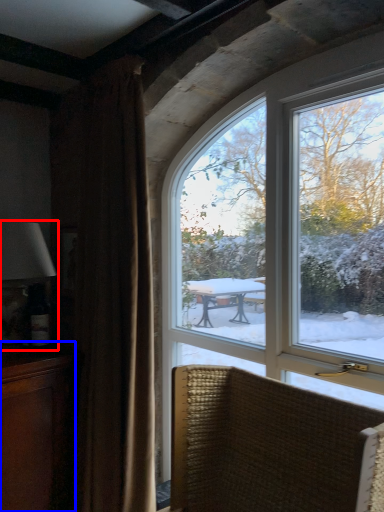
Question: Among these objects, which one is nearest to the camera, table lamp (highlighted by a red box) or cabinetry (highlighted by a blue box)?

Choices:
 (A) table lamp
 (B) cabinetry

Answer: (B)